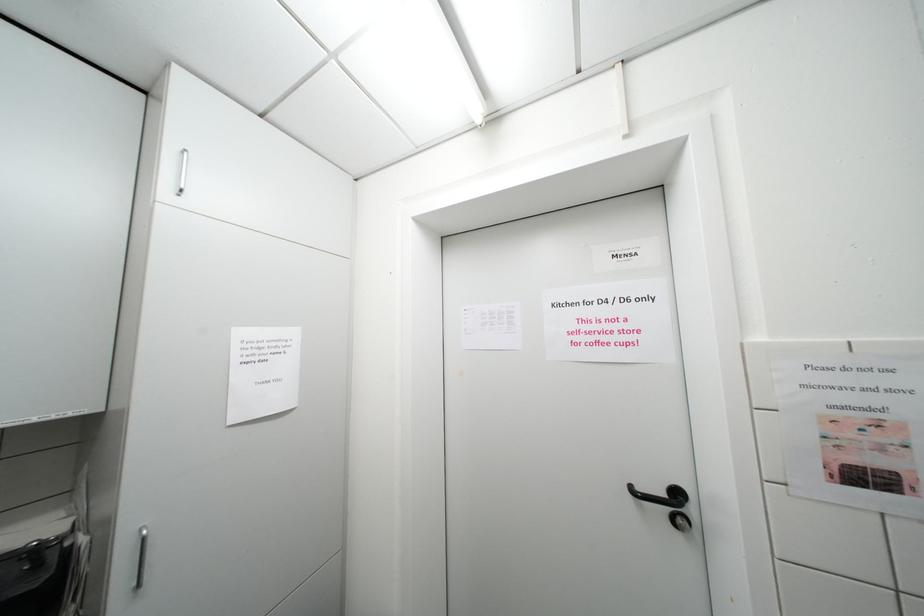
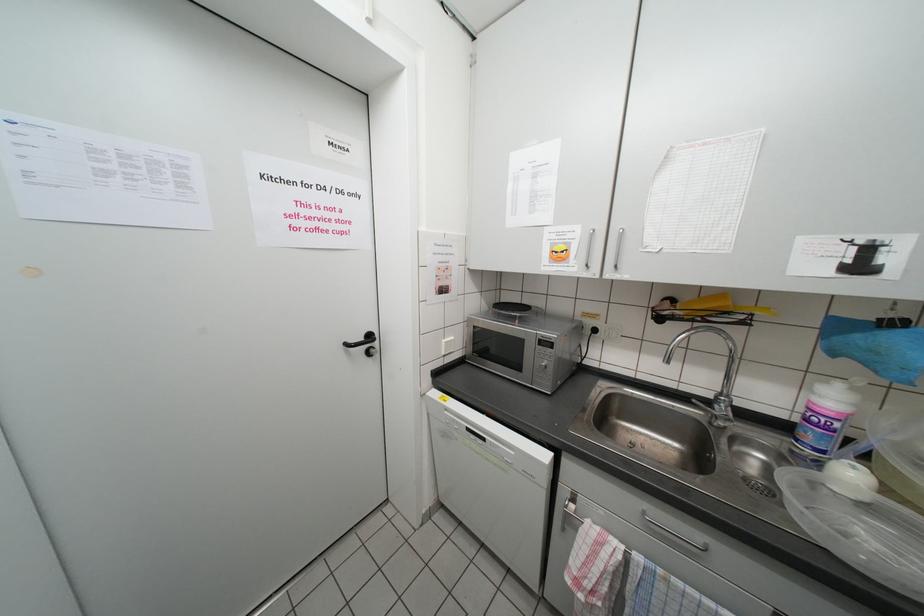
Question: Based on the continuous images, in which direction is the camera rotating? Reply with the corresponding letter.

Choices:
 (A) Left
 (B) Right
 (C) Up
 (D) Down

Answer: (B)